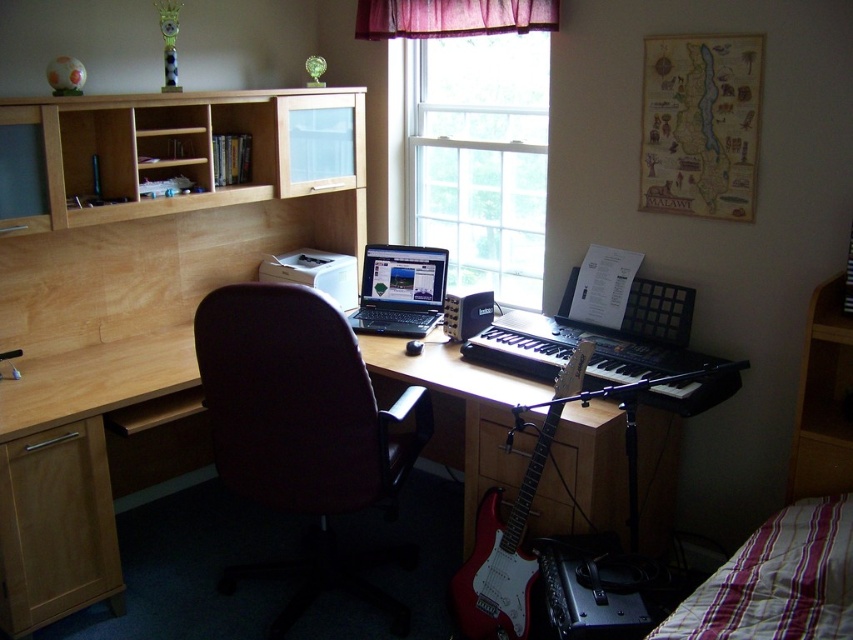
Based on the photo, you are planning to move the brown leather swivel chair at center to the other side of the room. The doorway to the next room is narrower than the transparent glass window at center. Will the chair fit through the doorway?

The brown leather swivel chair at center is wider than the transparent glass window at center. Since the doorway is narrower than the window, the chair will not fit through the doorway.